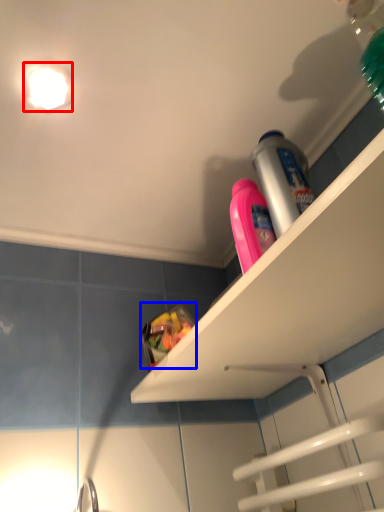
Question: Which point is further to the camera, light fixture (highlighted by a red box) or food (highlighted by a blue box)?

Choices:
 (A) light fixture
 (B) food

Answer: (B)